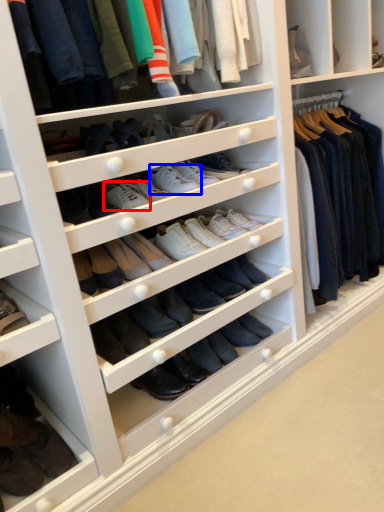
Question: Which object appears farthest to the camera in this image, shoe (highlighted by a red box) or shoe (highlighted by a blue box)?

Choices:
 (A) shoe
 (B) shoe

Answer: (B)